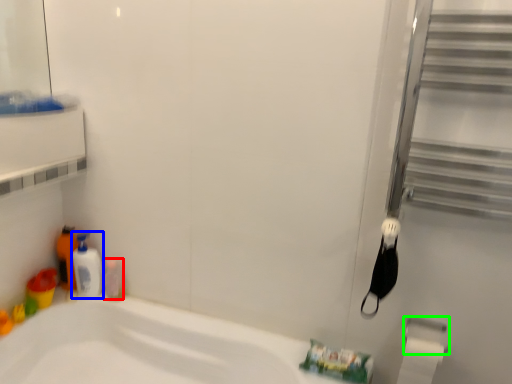
Question: Which object is positioned farthest from toiletry (highlighted by a red box)? Select from cleaning product (highlighted by a blue box) and towel bar (highlighted by a green box).

Choices:
 (A) cleaning product
 (B) towel bar

Answer: (B)